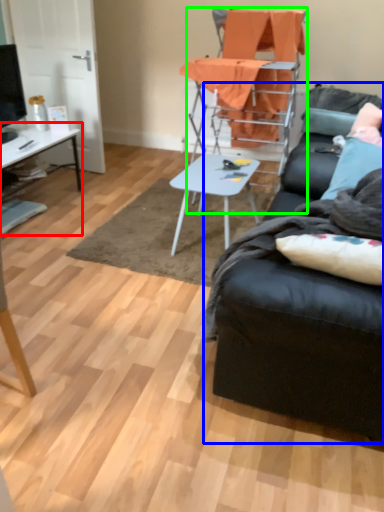
Question: Which object is positioned closest to desk (highlighted by a red box)? Select from studio couch (highlighted by a blue box) and chair (highlighted by a green box).

Choices:
 (A) studio couch
 (B) chair

Answer: (B)